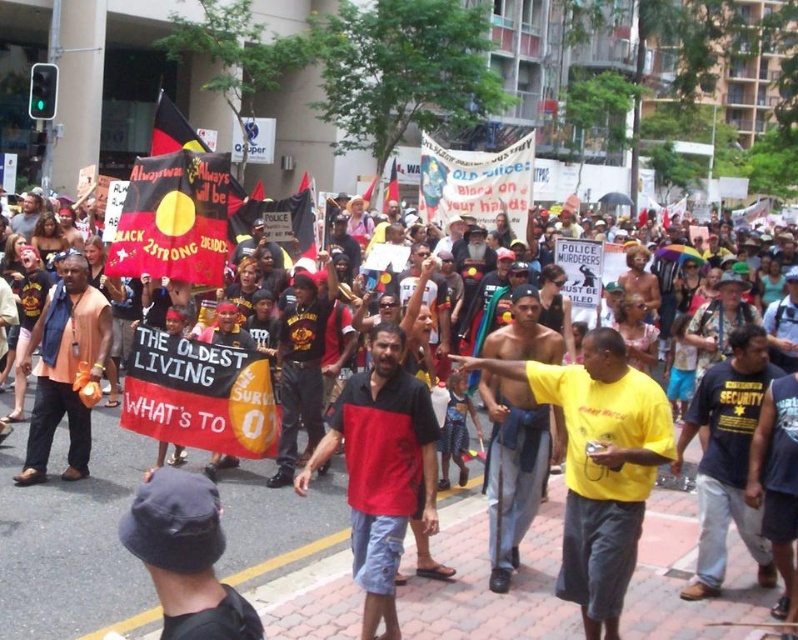
You are a photographer trying to capture the protest scene. You notice the yellow cotton shirt at center and the red fabric flag at upper left. Which object would appear narrower in your photo?

The yellow cotton shirt at center is thinner than the red fabric flag at upper left, so it would appear narrower in the photo.